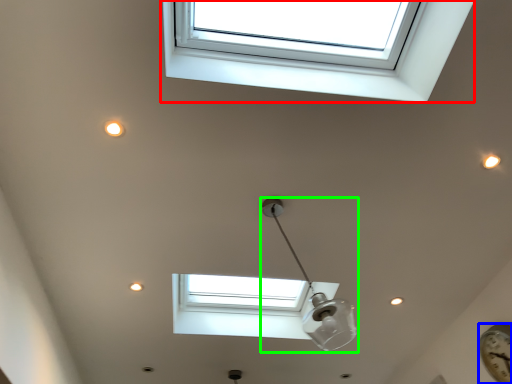
Question: Which object is the closest to the window (highlighted by a red box)? Choose among these: clock (highlighted by a blue box) or lamp (highlighted by a green box).

Choices:
 (A) clock
 (B) lamp

Answer: (B)